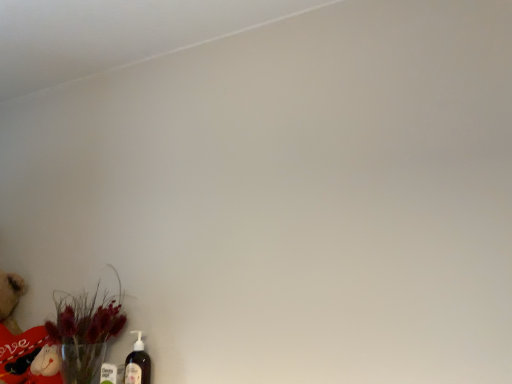
Question: Is translucent plastic bottle at lower left wider or thinner than translucent glass vase at lower left?

Choices:
 (A) wide
 (B) thin

Answer: (B)

Question: Is translucent plastic bottle at lower left bigger or smaller than translucent glass vase at lower left?

Choices:
 (A) small
 (B) big

Answer: (A)

Question: In the image, is translucent plastic bottle at lower left on the left side or the right side of translucent glass vase at lower left?

Choices:
 (A) left
 (B) right

Answer: (B)

Question: Choose the correct answer: Is translucent glass vase at lower left inside translucent plastic bottle at lower left or outside it?

Choices:
 (A) outside
 (B) inside

Answer: (A)

Question: Considering the positions of translucent glass vase at lower left and translucent plastic bottle at lower left in the image, is translucent glass vase at lower left wider or thinner than translucent plastic bottle at lower left?

Choices:
 (A) thin
 (B) wide

Answer: (B)

Question: From a real-world perspective, is translucent glass vase at lower left above or below translucent plastic bottle at lower left?

Choices:
 (A) below
 (B) above

Answer: (B)

Question: From the image's perspective, is translucent glass vase at lower left above or below translucent plastic bottle at lower left?

Choices:
 (A) above
 (B) below

Answer: (A)